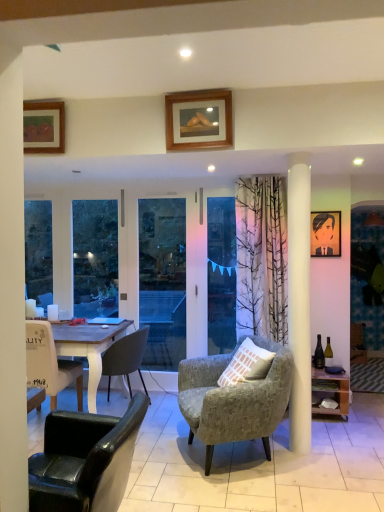
Identify the location of blank space situated above wooden picture frame at upper center, which is counted as the 2th picture frame, starting from the top (from a real-world perspective). (195, 92).